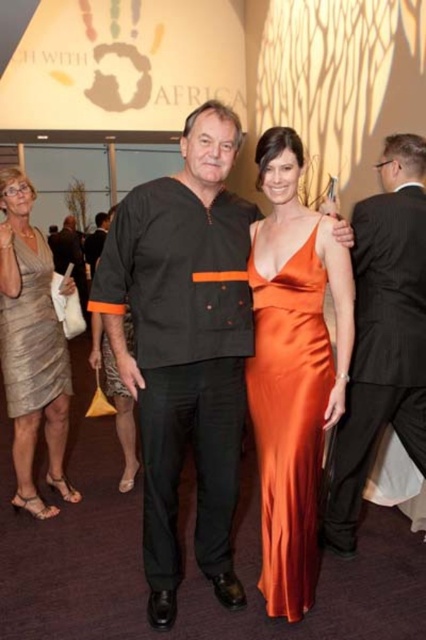
You are a photographer at the event and want to focus your camera on the black matte shirt at center. What are the coordinates where you should aim your camera?

The 2D location of the black matte shirt at center is at point [184,346], so you should aim your camera at those coordinates to focus on the black matte shirt at center.

You are a photographer at the event and want to ensure both the black matte shirt at center and the shiny silver dress at center are clearly visible in your wide shot. Given their sizes, which one might you need to adjust your focus on to ensure clarity?

The black matte shirt at center is smaller than the shiny silver dress at center, so you may need to adjust focus on the smaller black matte shirt at center to ensure clarity in the wide shot.

You are a photographer at the event and need to ensure both the black matte shirt at center and the shiny orange dress at center are clearly visible in the photo. Given their sizes, which one might require more careful framing to avoid being overshadowed?

The shiny orange dress at center is smaller in size than the black matte shirt at center, so it might require more careful framing to ensure it stands out and isn not overshadowed by the larger black matte shirt at center.